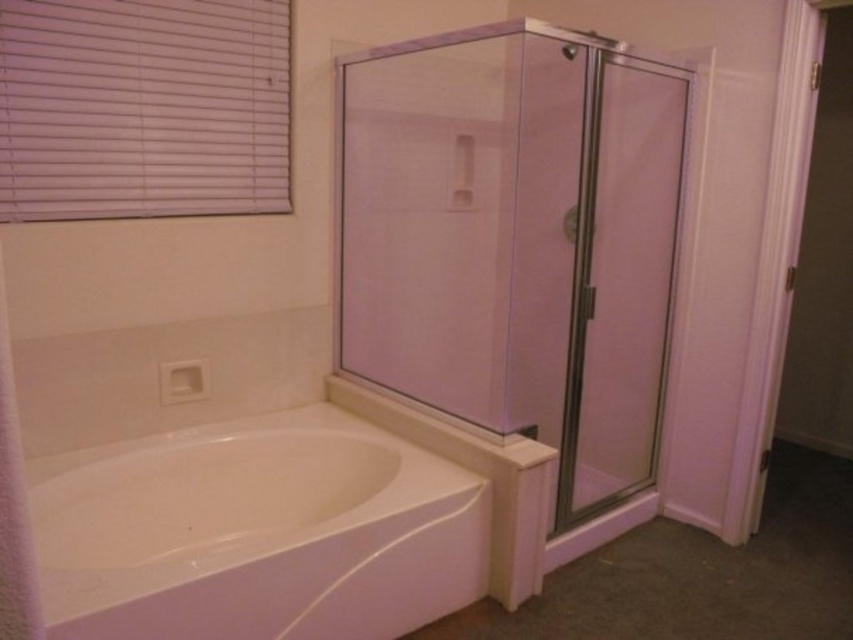
Question: Does white glossy bathtub at lower left have a smaller size compared to white plastic blinds at upper left?

Choices:
 (A) no
 (B) yes

Answer: (A)

Question: Which point is closer to the camera taking this photo?

Choices:
 (A) (x=26, y=508)
 (B) (x=596, y=320)

Answer: (A)

Question: Observing the image, what is the correct spatial positioning of clear glass shower door at center in reference to white plastic blinds at upper left?

Choices:
 (A) right
 (B) left

Answer: (A)

Question: Estimate the real-world distances between objects in this image. Which object is farther from the white soft towel at left?

Choices:
 (A) clear glass shower door at center
 (B) clear glass shower door at right
 (C) white plastic blinds at upper left

Answer: (B)

Question: Which point appears closest to the camera in this image?

Choices:
 (A) (1, 554)
 (B) (628, 164)

Answer: (A)

Question: Is clear glass shower door at center thinner than white soft towel at left?

Choices:
 (A) no
 (B) yes

Answer: (A)